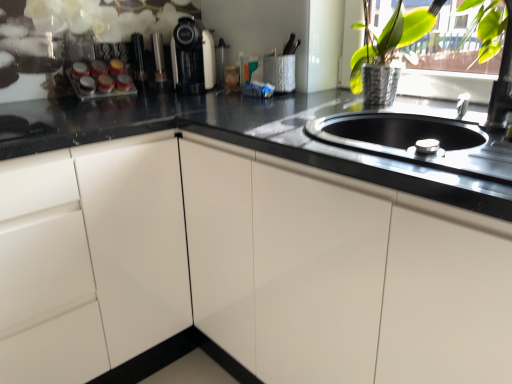
What do you see at coordinates (192, 58) in the screenshot? I see `matte black coffee machine at upper center` at bounding box center [192, 58].

Image resolution: width=512 pixels, height=384 pixels. Describe the element at coordinates (390, 38) in the screenshot. I see `metallic silver vase at upper right` at that location.

Find the location of a particular element. This screenshot has width=512, height=384. white glossy cabinet at left is located at coordinates (136, 240).

Does point (361, 73) come in front of point (176, 210)?

No.

Does metallic silver vase at upper right have a greater width compared to white glossy cabinet at left?

No, metallic silver vase at upper right is not wider than white glossy cabinet at left.

Looking at this image, which of these two, metallic silver vase at upper right or white glossy cabinet at left, is bigger?

white glossy cabinet at left.

In the scene shown: From the image's perspective, is metallic silver vase at upper right located above white glossy cabinet at left?

Yes, from the image's perspective, metallic silver vase at upper right is over white glossy cabinet at left.

Is metallic silver vase at upper right facing towards matte black coffee machine at upper center?

No, metallic silver vase at upper right is not aimed at matte black coffee machine at upper center.

Between metallic silver vase at upper right and matte black coffee machine at upper center, which one has smaller width?

metallic silver vase at upper right is thinner.

There is a matte black coffee machine at upper center. Identify the location of floral arrangement above it (from a real-world perspective). The image size is (512, 384). (390, 38).

Is metallic silver vase at upper right inside or outside of matte black coffee machine at upper center?

metallic silver vase at upper right is outside matte black coffee machine at upper center.

Consider the image. Who is bigger, matte black coffee machine at upper center or metallic silver vase at upper right?

metallic silver vase at upper right is bigger.

In the scene shown: Is matte black coffee machine at upper center positioned far away from metallic silver vase at upper right?

That's not correct — matte black coffee machine at upper center is a little close to metallic silver vase at upper right.

Looking at this image, is matte black coffee machine at upper center positioned with its back to metallic silver vase at upper right?

No, metallic silver vase at upper right is not at the back of matte black coffee machine at upper center.

Where is `coffee machine that appears below the metallic silver vase at upper right (from a real-world perspective)`? coffee machine that appears below the metallic silver vase at upper right (from a real-world perspective) is located at coordinates (192, 58).

From a real-world perspective, which object stands above the other?

metallic silver vase at upper right.

Could you tell me if white glossy cabinet at left is facing metallic silver vase at upper right?

No, white glossy cabinet at left is not turned towards metallic silver vase at upper right.

What's the angular difference between white glossy cabinet at left and metallic silver vase at upper right's facing directions?

The facing directions of white glossy cabinet at left and metallic silver vase at upper right are 88.3 degrees apart.

Looking at the image, does white glossy cabinet at left seem bigger or smaller compared to metallic silver vase at upper right?

Clearly, white glossy cabinet at left is larger in size than metallic silver vase at upper right.

How much distance is there between matte black coffee machine at upper center and white glossy cabinet at left?

29.45 inches.

Based on the photo, how different are the orientations of matte black coffee machine at upper center and white glossy cabinet at left in degrees?

They differ by 42.4 degrees in their facing directions.

Would you consider matte black coffee machine at upper center to be distant from white glossy cabinet at left?

That's not correct — matte black coffee machine at upper center is a little close to white glossy cabinet at left.

Does matte black coffee machine at upper center lie in front of white glossy cabinet at left?

No, matte black coffee machine at upper center is behind white glossy cabinet at left.

Is white glossy cabinet at left bigger or smaller than matte black coffee machine at upper center?

Considering their sizes, white glossy cabinet at left takes up more space than matte black coffee machine at upper center.

Is white glossy cabinet at left not within matte black coffee machine at upper center?

Yes, white glossy cabinet at left is located beyond the bounds of matte black coffee machine at upper center.

From a real-world perspective, which is physically below, white glossy cabinet at left or matte black coffee machine at upper center?

white glossy cabinet at left.

Locate an element on the screen. This screenshot has width=512, height=384. cabinetry that appears below the metallic silver vase at upper right (from a real-world perspective) is located at coordinates (136, 240).

Identify the location of floral arrangement above the matte black coffee machine at upper center (from a real-world perspective). The height and width of the screenshot is (384, 512). (390, 38).

When comparing their distances from white glossy cabinet at left, does matte black coffee machine at upper center or metallic silver vase at upper right seem further?

metallic silver vase at upper right.

Based on their spatial positions, is metallic silver vase at upper right or matte black coffee machine at upper center closer to white glossy cabinet at left?

matte black coffee machine at upper center.

Which object lies nearer to the anchor point matte black coffee machine at upper center, white glossy cabinet at left or metallic silver vase at upper right?

metallic silver vase at upper right.

Which object lies further to the anchor point metallic silver vase at upper right, matte black coffee machine at upper center or white glossy cabinet at left?

white glossy cabinet at left.

Based on their spatial positions, is metallic silver vase at upper right or white glossy cabinet at left further from matte black coffee machine at upper center?

Based on the image, white glossy cabinet at left appears to be further to matte black coffee machine at upper center.

When comparing their distances from metallic silver vase at upper right, does white glossy cabinet at left or matte black coffee machine at upper center seem further?

white glossy cabinet at left lies further to metallic silver vase at upper right than the other object.

At what (x,y) coordinates should I click in order to perform the action: click on coffee machine located between white glossy cabinet at left and metallic silver vase at upper right in the left-right direction. Please return your answer as a coordinate pair (x, y). Looking at the image, I should click on (192, 58).